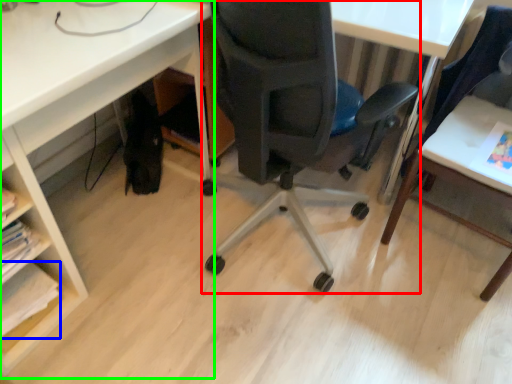
Question: Which is nearer to the chair (highlighted by a red box)? book (highlighted by a blue box) or desk (highlighted by a green box).

Choices:
 (A) book
 (B) desk

Answer: (B)